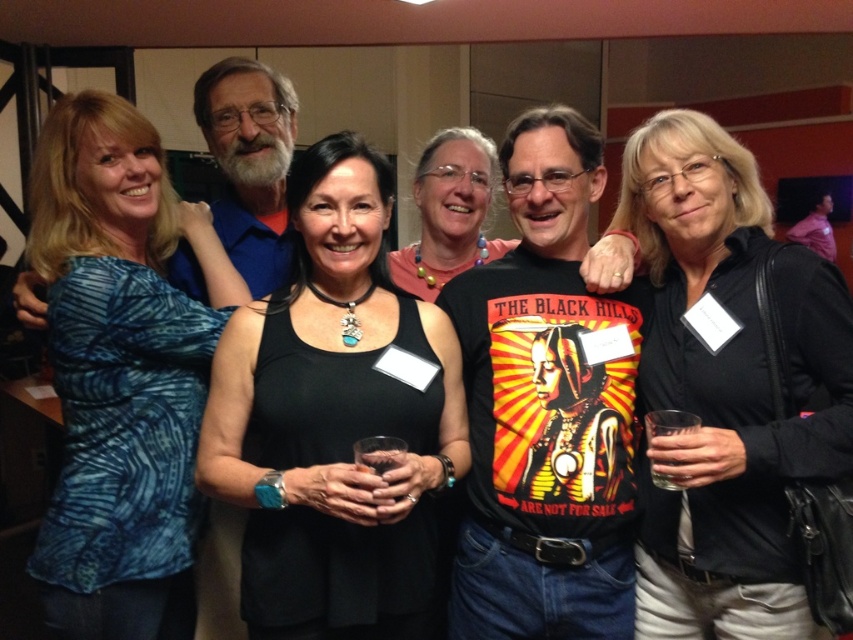
Question: Which object appears closest to the camera in this image?

Choices:
 (A) black matte tank top at center
 (B) shiny black t-shirt at center
 (C) blue printed shirt at left

Answer: (A)

Question: Is blue printed shirt at left wider than matte black tank top at center?

Choices:
 (A) no
 (B) yes

Answer: (B)

Question: Which object is closer to the camera taking this photo?

Choices:
 (A) black matte tank top at center
 (B) shiny black t-shirt at center

Answer: (A)

Question: Can you confirm if black matte tank top at center is positioned above blue printed shirt at left?

Choices:
 (A) yes
 (B) no

Answer: (B)

Question: Among these objects, which one is nearest to the camera?

Choices:
 (A) black matte tank top at center
 (B) matte black tank top at center
 (C) shiny black t-shirt at center

Answer: (A)

Question: Is black matte tank top at center thinner than shiny black t-shirt at center?

Choices:
 (A) yes
 (B) no

Answer: (B)